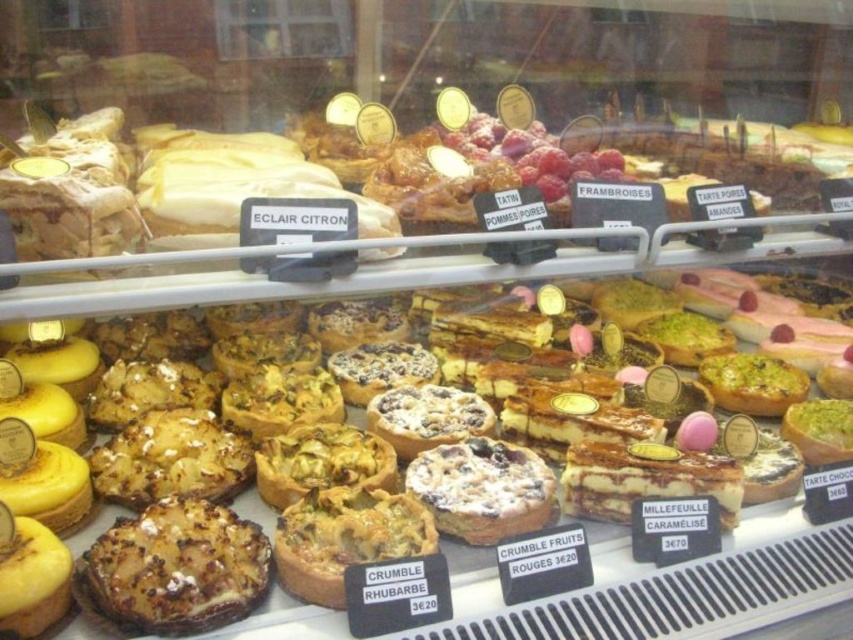
Question: Is golden flaky tartlet at center bigger than golden brown flaky tart at lower left?

Choices:
 (A) yes
 (B) no

Answer: (A)

Question: Does golden brown flaky tart at center appear over crumbly brown tart at center?

Choices:
 (A) no
 (B) yes

Answer: (A)

Question: Among these points, which one is farthest from the camera?

Choices:
 (A) (9, 600)
 (B) (360, 508)
 (C) (194, 573)

Answer: (B)

Question: Which object is farther from the camera taking this photo?

Choices:
 (A) golden brown flaky tart at lower left
 (B) crumbly brown tart at center
 (C) golden flaky tartlet at center
 (D) golden brown flaky tart at center

Answer: (B)

Question: Which point appears closest to the camera in this image?

Choices:
 (A) (202, 545)
 (B) (541, 499)
 (C) (28, 620)
 (D) (392, 499)

Answer: (C)

Question: Does golden flaky tartlet at center have a greater width compared to golden brown flaky tart at lower left?

Choices:
 (A) no
 (B) yes

Answer: (B)